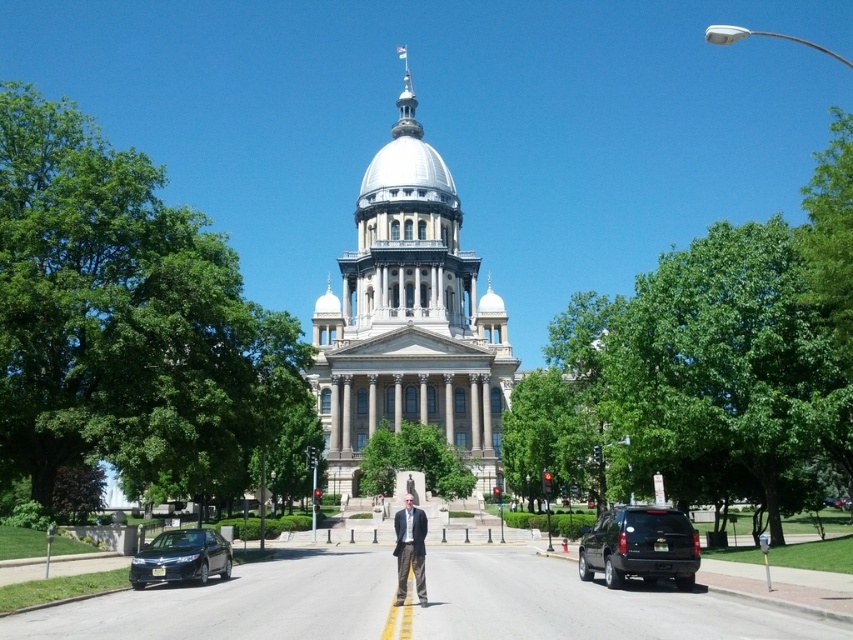
You are standing in the plaza in front of the grand neoclassical building. You see a black matte suv at lower right and light brown textured pants at center. Which object is closer to you?

The black matte suv at lower right is closer to you because it is positioned below the light brown textured pants at center, indicating it is lower in the visual hierarchy and thus nearer.

You are standing in front of the grand neoclassical building and want to determine which of the two points, point (157, 547) or point (396, 556), is closer to you. Based on the scene description, which point is nearer?

Point (157, 547) is further to the viewer than point (396, 556). Wait, no, the description says the opposite. Let me check again. The Objects Description states that point (157, 547) is further to the viewer than point (396, 556). Therefore, the point closer to you is point (396, 556) because it is less further away. Hmm, the wording is confusing. Let me rephrase. Since point A is further than point B, then point B is closer. So the answer should be point (396, 556) is nearer.